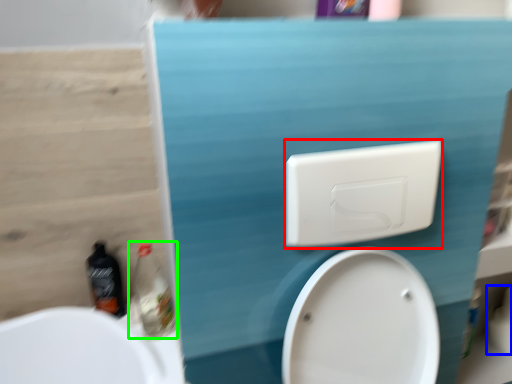
Question: Which is nearer to the light switch (highlighted by a red box)? toilet paper (highlighted by a blue box) or cleaning product (highlighted by a green box).

Choices:
 (A) toilet paper
 (B) cleaning product

Answer: (B)